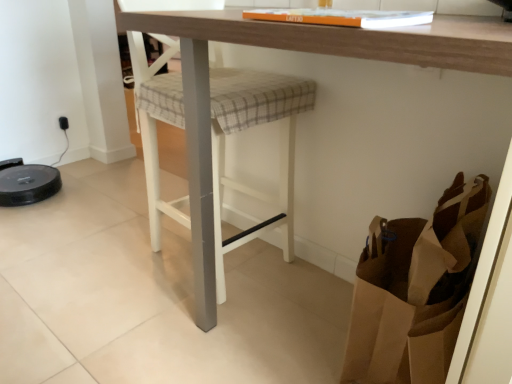
Image resolution: width=512 pixels, height=384 pixels. Identify the location of free space that is to the left of plaid fabric step stool at center. (98, 262).